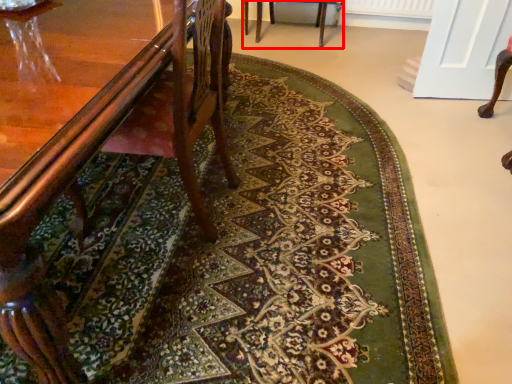
Question: Where is chair (annotated by the red box) located in relation to chair in the image?

Choices:
 (A) left
 (B) right

Answer: (B)